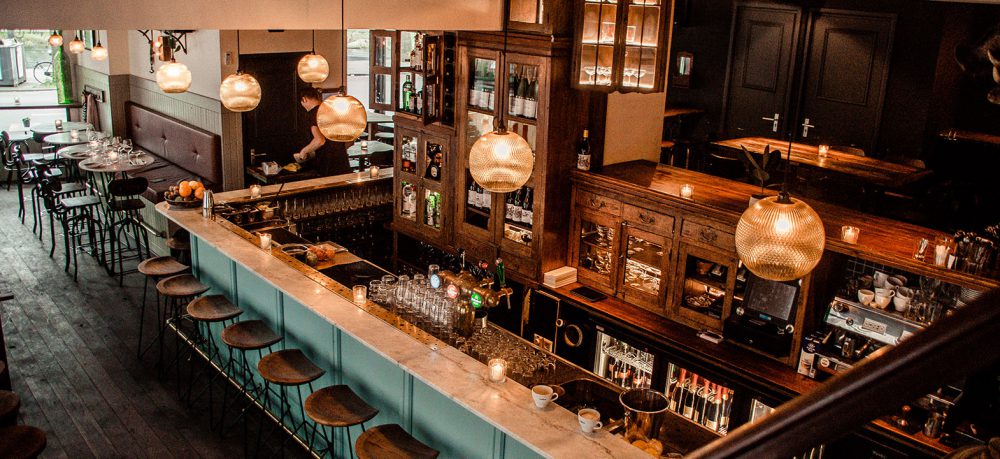
This screenshot has height=459, width=1000. I want to click on high top tables, so click(x=48, y=124), click(x=59, y=136), click(x=84, y=151), click(x=103, y=166).